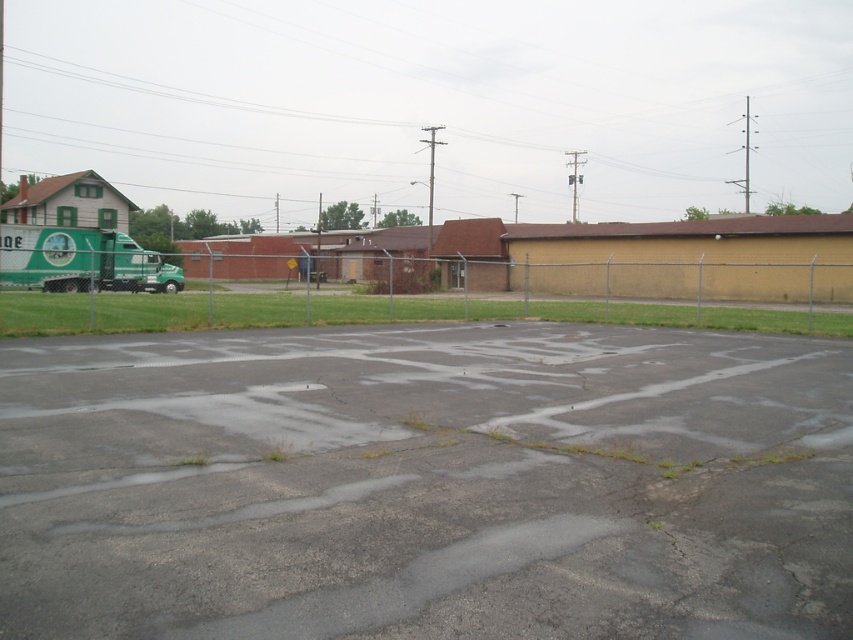
Does gray asphalt parking lot at center have a lesser width compared to metallic chain-link fence at center?

Yes.

Between gray asphalt parking lot at center and metallic chain-link fence at center, which one has more height?

metallic chain-link fence at center is taller.

Which is behind, point (312, 369) or point (804, 321)?

Positioned behind is point (804, 321).

Find the location of a particular element. This screenshot has width=853, height=640. gray asphalt parking lot at center is located at coordinates (425, 484).